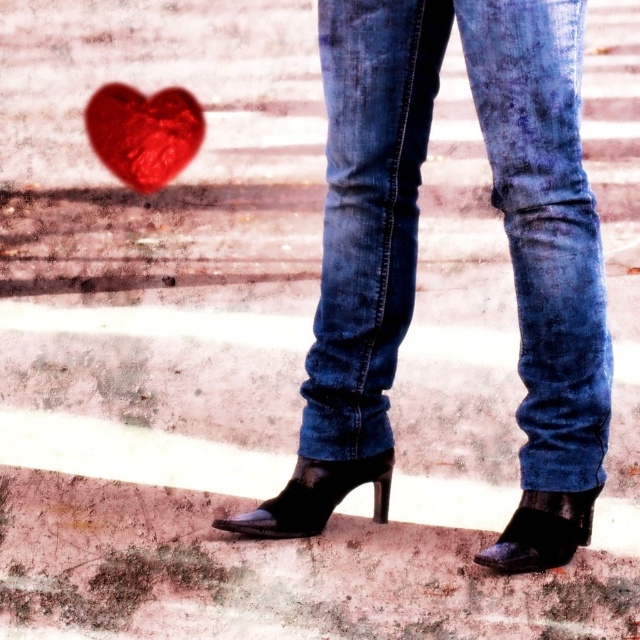
Question: Which object is closer to the camera taking this photo?

Choices:
 (A) shiny red heart at upper left
 (B) denim jeans at center

Answer: (B)

Question: Which point is farther to the camera?

Choices:
 (A) (536, 492)
 (B) (577, 353)
 (C) (282, 516)

Answer: (C)

Question: Is shiny red heart at upper left below black leather boot at lower right?

Choices:
 (A) yes
 (B) no

Answer: (B)

Question: Which object is the closest to the black leather boot at lower center?

Choices:
 (A) shiny red heart at upper left
 (B) denim jeans at center
 (C) black leather boot at lower right

Answer: (B)

Question: Does denim jeans at center appear under shiny red heart at upper left?

Choices:
 (A) no
 (B) yes

Answer: (B)

Question: Observing the image, what is the correct spatial positioning of shiny red heart at upper left in reference to black leather boot at lower center?

Choices:
 (A) above
 (B) below

Answer: (A)